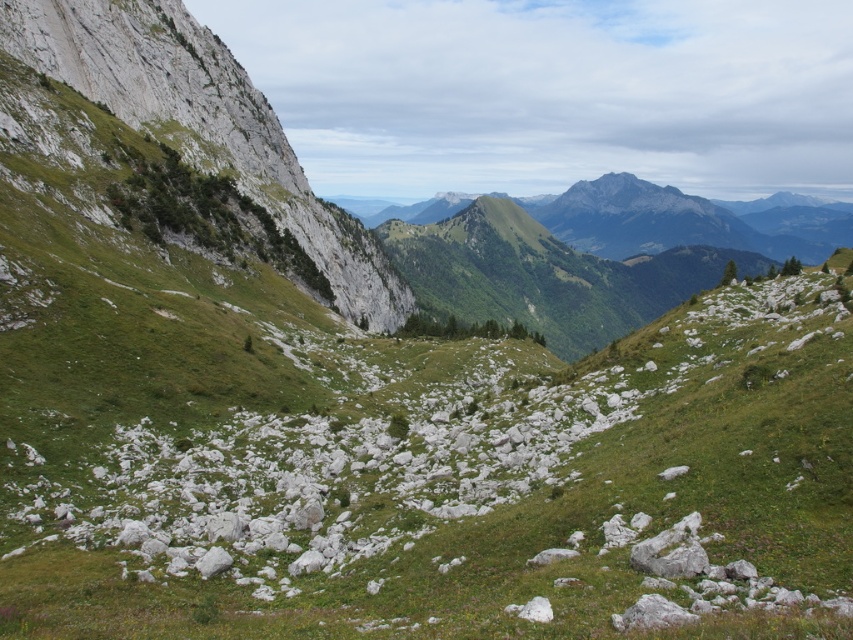
Question: Can you confirm if green grassy at center is bigger than green grassy slope at left?

Choices:
 (A) yes
 (B) no

Answer: (B)

Question: Is green grassy at center closer to camera compared to green grassy slope at left?

Choices:
 (A) yes
 (B) no

Answer: (A)

Question: Is green grassy at center wider than green grassy slope at left?

Choices:
 (A) no
 (B) yes

Answer: (B)

Question: Which point appears farthest from the camera in this image?

Choices:
 (A) (15, 12)
 (B) (838, 417)

Answer: (A)

Question: Which object appears farthest from the camera in this image?

Choices:
 (A) green grassy at center
 (B) green grassy slope at left

Answer: (B)

Question: Which of the following is the closest to the observer?

Choices:
 (A) green grassy slope at left
 (B) green grassy at center

Answer: (B)